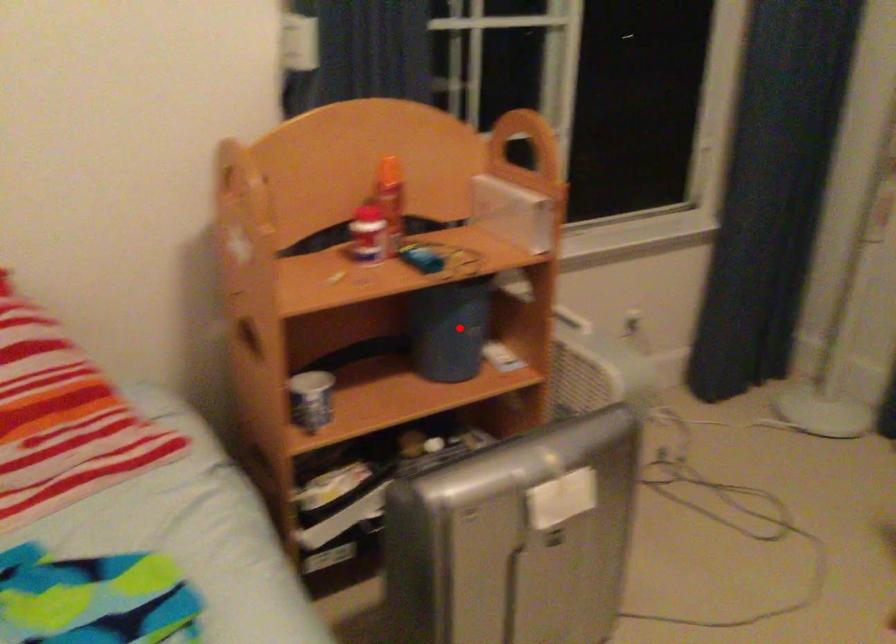
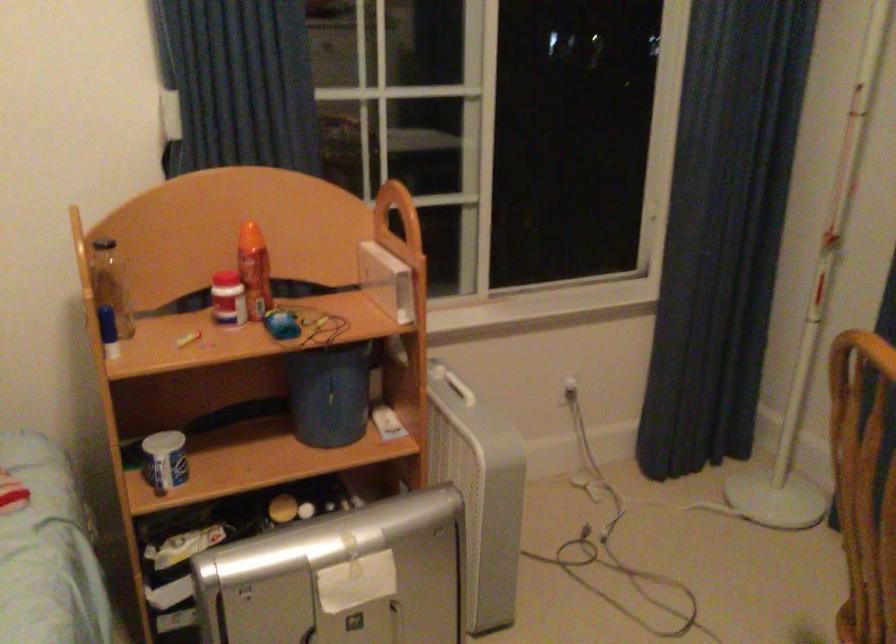
In the second image, find the point that corresponds to the highlighted location in the first image.

(331, 395)